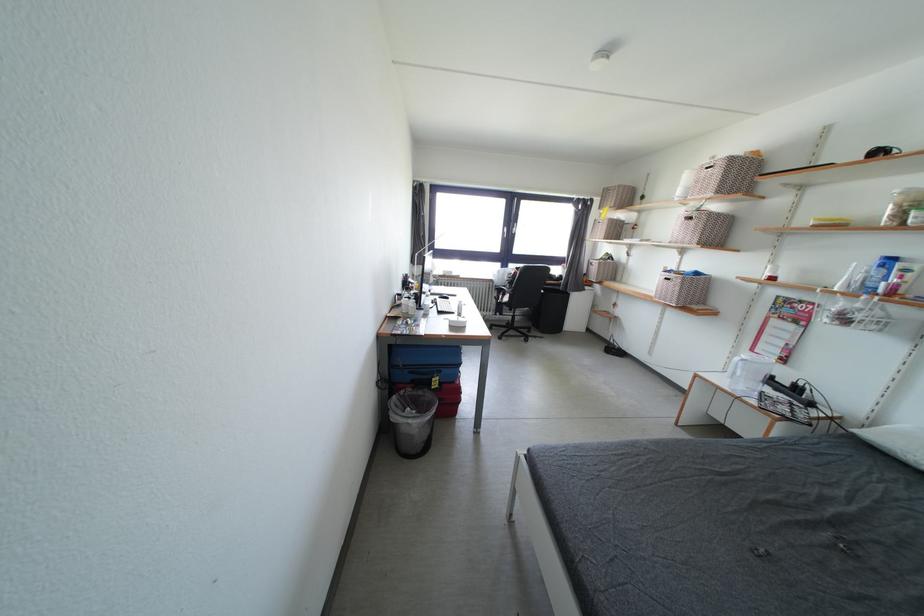
Where is `mesh trash can`? The image size is (924, 616). mesh trash can is located at coordinates (410, 427).